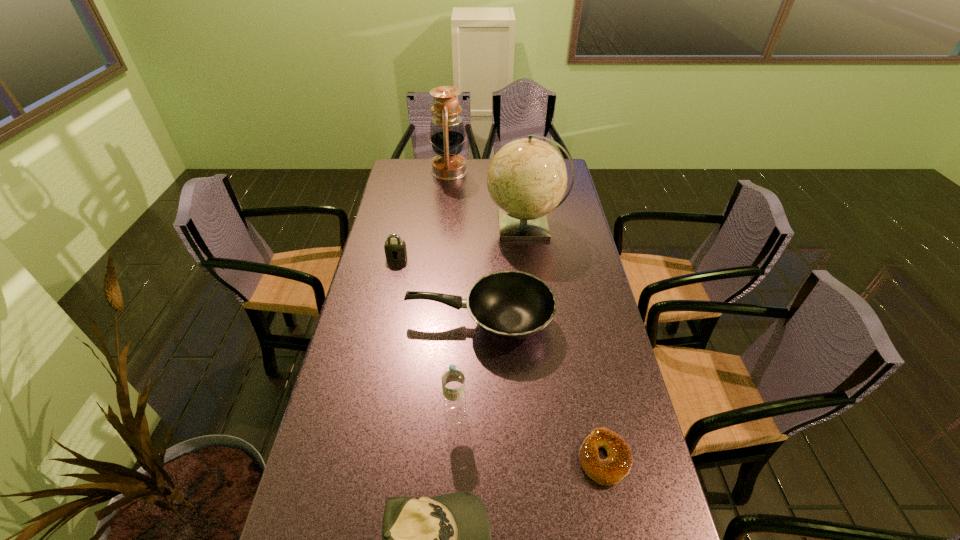
Identify the location of free spot located on the surface of the sixth nearest object showing Europe and Africa. The image size is (960, 540). (400, 226).

In order to click on free point located 0.080m on the surface of the sixth nearest object showing Europe and Africa in this screenshot , I will do `click(466, 226)`.

I want to click on vacant space located 0.200m on the surface of the sixth nearest object showing Europe and Africa, so click(436, 226).

What are the coordinates of `vacant region located on the right of the water bottle` in the screenshot? It's located at (609, 415).

Where is `free spot located 0.180m on the back of the fourth farthest object`? This screenshot has width=960, height=540. free spot located 0.180m on the back of the fourth farthest object is located at coordinates (480, 256).

Where is `vacant space located 0.310m at the front of the leftmost object near the keyhole`? The width and height of the screenshot is (960, 540). vacant space located 0.310m at the front of the leftmost object near the keyhole is located at coordinates (382, 327).

Locate an element on the screen. This screenshot has width=960, height=540. vacant space positioned 0.190m on the back of the bagel is located at coordinates click(x=586, y=368).

This screenshot has width=960, height=540. I want to click on object that is at the far edge, so click(447, 134).

This screenshot has height=540, width=960. Find the location of `object at the left edge`. object at the left edge is located at coordinates (397, 247).

Identify the location of globe that is at the right edge. The height and width of the screenshot is (540, 960). (527, 178).